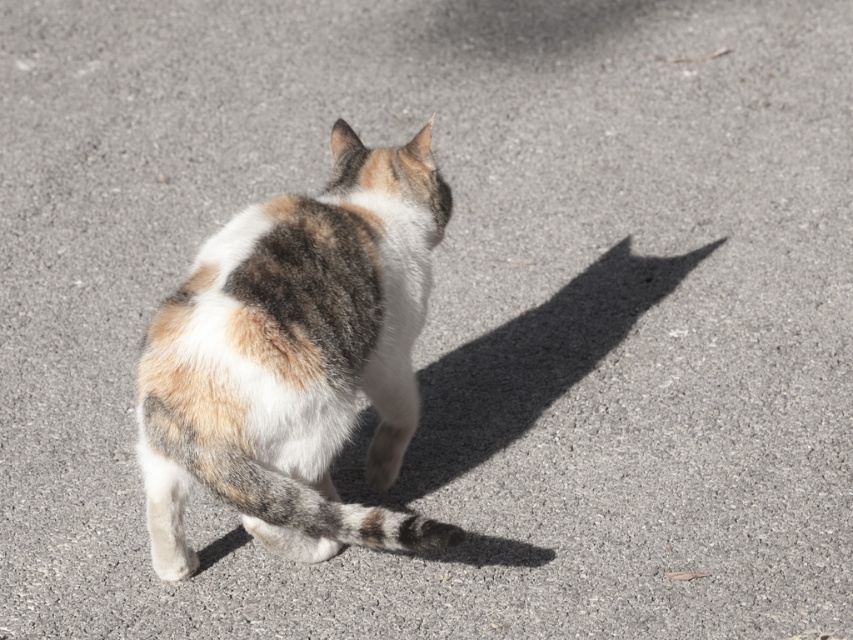
Question: Is calico fur cat at center wider than gray striped tail at center?

Choices:
 (A) no
 (B) yes

Answer: (B)

Question: Is calico fur cat at center positioned before gray striped tail at center?

Choices:
 (A) no
 (B) yes

Answer: (A)

Question: Which of the following is the closest to the observer?

Choices:
 (A) calico fur cat at center
 (B) gray striped tail at center

Answer: (B)

Question: Is calico fur cat at center bigger than gray striped tail at center?

Choices:
 (A) yes
 (B) no

Answer: (A)